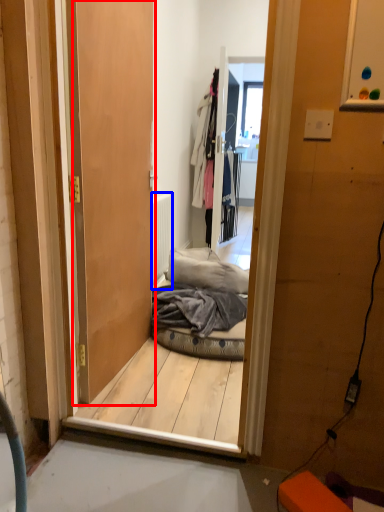
Question: Which object appears farthest to the camera in this image, door (highlighted by a red box) or radiator (highlighted by a blue box)?

Choices:
 (A) door
 (B) radiator

Answer: (B)